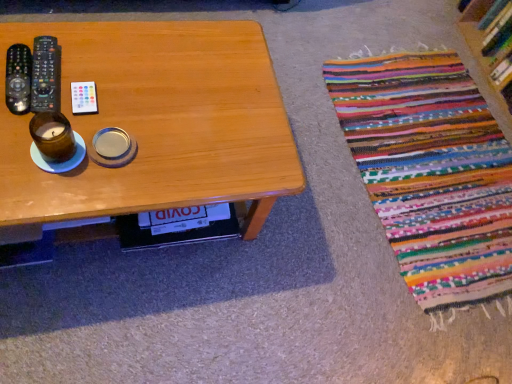
Identify the location of vacant area that lies to the right of wooden table at center. (314, 252).